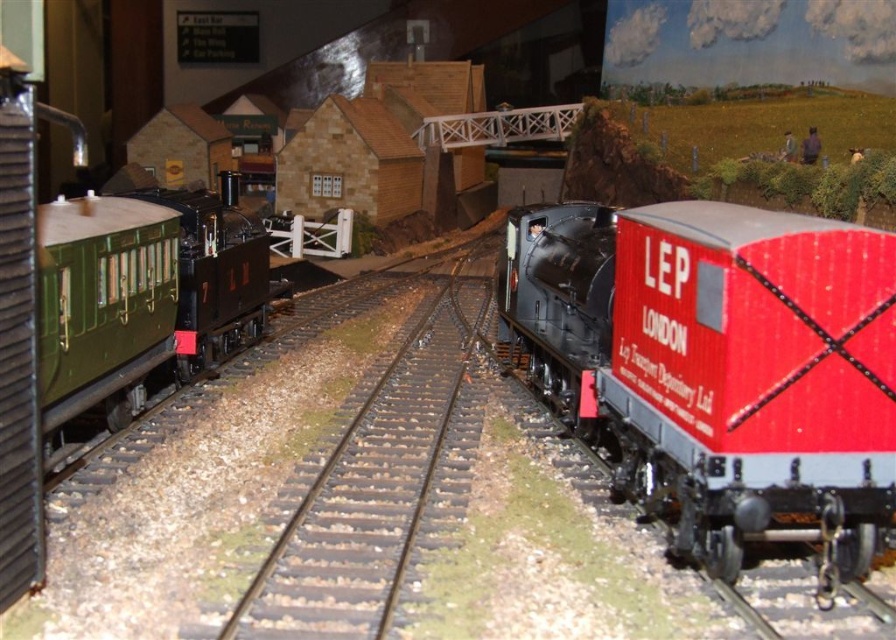
Can you confirm if green polished wood passenger car at left is positioned above black metal train track at center?

Correct, green polished wood passenger car at left is located above black metal train track at center.

The height and width of the screenshot is (640, 896). What do you see at coordinates (142, 298) in the screenshot?
I see `green polished wood passenger car at left` at bounding box center [142, 298].

Where is `green polished wood passenger car at left`? The width and height of the screenshot is (896, 640). green polished wood passenger car at left is located at coordinates (142, 298).

Who is positioned more to the right, red glossy freight car at center or black metal train track at center?

red glossy freight car at center

Describe the element at coordinates (718, 364) in the screenshot. I see `red glossy freight car at center` at that location.

Identify the location of red glossy freight car at center. The image size is (896, 640). click(x=718, y=364).

Which of these two, red glossy freight car at center or green polished wood passenger car at left, stands taller?

red glossy freight car at center is taller.

Between red glossy freight car at center and green polished wood passenger car at left, which one has less height?

green polished wood passenger car at left

Is point (819, 481) positioned in front of point (207, 241)?

Yes, point (819, 481) is closer to viewer.

Locate an element on the screen. The width and height of the screenshot is (896, 640). red glossy freight car at center is located at coordinates (718, 364).